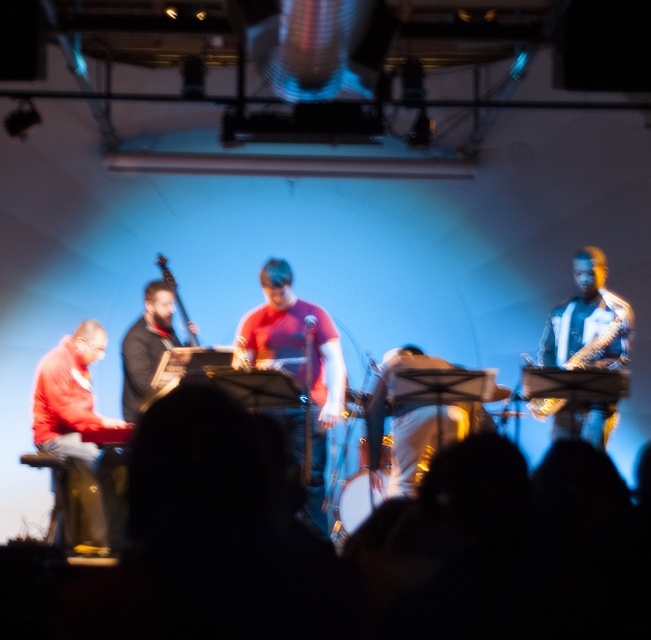
Question: Is red matte jacket at left below metallic silver keyboard at right?

Choices:
 (A) yes
 (B) no

Answer: (A)

Question: Which point is closer to the camera?

Choices:
 (A) red matte jacket at left
 (B) metallic dark brown upright bass at center
 (C) matte red shirt at center
 (D) matte black bass at center

Answer: (C)

Question: Is matte red shirt at center above metallic silver keyboard at right?

Choices:
 (A) no
 (B) yes

Answer: (A)

Question: Which of the following is the closest to the observer?

Choices:
 (A) red matte jacket at left
 (B) matte red shirt at center
 (C) matte black bass at center

Answer: (B)

Question: Which point appears farthest from the camera in this image?

Choices:
 (A) (195, 333)
 (B) (600, 403)
 (C) (575, 368)
 (D) (305, 422)

Answer: (A)

Question: In this image, where is matte black bass at center located relative to metallic dark brown upright bass at center?

Choices:
 (A) right
 (B) left

Answer: (B)